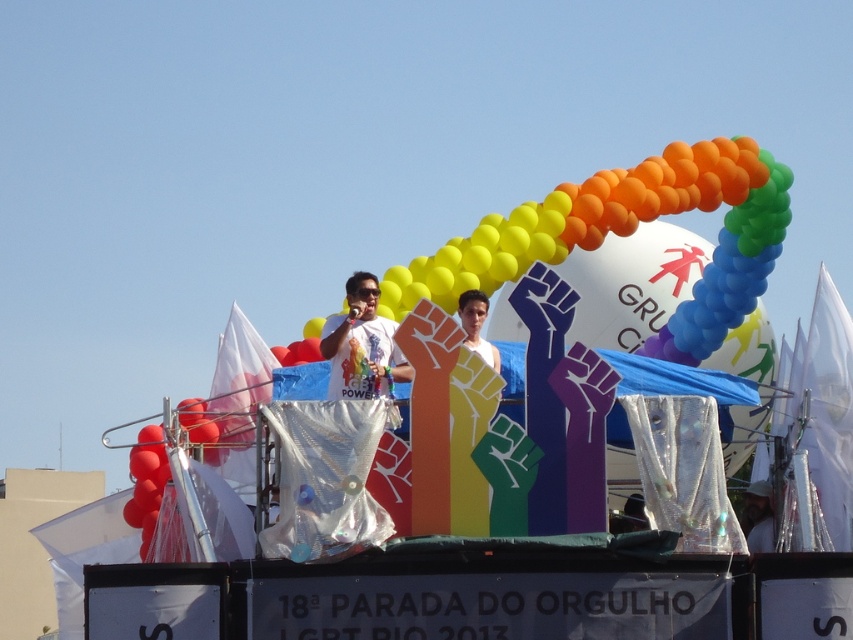
Question: Does rainbow balloons at center have a larger size compared to white fabric at center?

Choices:
 (A) yes
 (B) no

Answer: (A)

Question: Does white glossy t-shirt at center have a lesser width compared to white fabric at center?

Choices:
 (A) no
 (B) yes

Answer: (A)

Question: Does white glossy t-shirt at center have a smaller size compared to white matte shirt at center?

Choices:
 (A) no
 (B) yes

Answer: (A)

Question: Based on their relative distances, which object is farther from the white glossy t-shirt at center?

Choices:
 (A) white fabric at center
 (B) white matte shirt at center
 (C) rainbow balloons at center

Answer: (C)

Question: Which object is the closest to the white fabric at center?

Choices:
 (A) white glossy t-shirt at center
 (B) white matte shirt at center
 (C) rainbow balloons at center

Answer: (B)

Question: Among these points, which one is nearest to the camera?

Choices:
 (A) (753, 483)
 (B) (598, 205)
 (C) (462, 316)

Answer: (C)